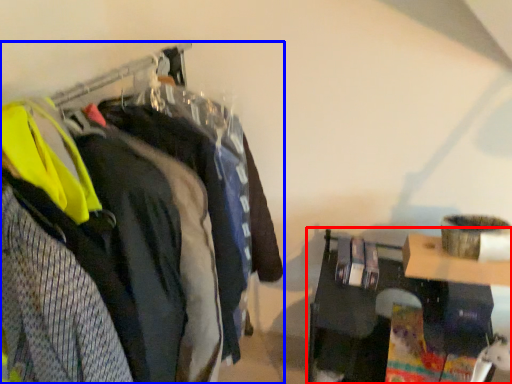
Question: Which point is further to the camera, furniture (highlighted by a red box) or closet (highlighted by a blue box)?

Choices:
 (A) furniture
 (B) closet

Answer: (A)